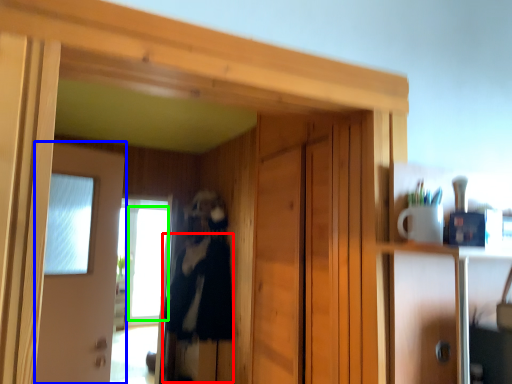
Question: Considering the real-world distances, which object is closest to clothing (highlighted by a red box)? door (highlighted by a blue box) or window (highlighted by a green box).

Choices:
 (A) door
 (B) window

Answer: (A)